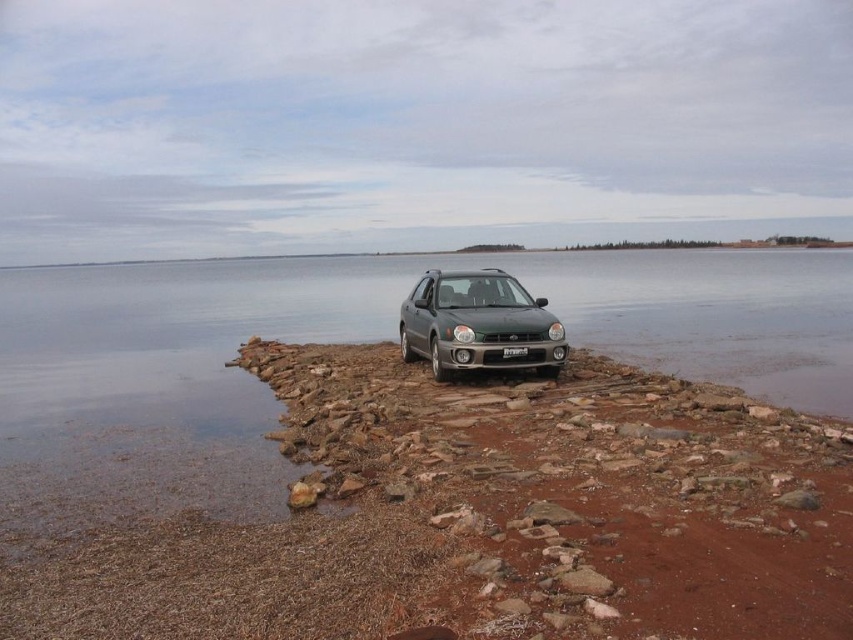
Does satin silver metallic hatchback at center have a lesser width compared to white plastic license plate at center?

Incorrect, satin silver metallic hatchback at center's width is not less than white plastic license plate at center's.

Is point (436, 280) positioned after point (502, 352)?

That is True.

Does point (527, 355) come closer to viewer compared to point (514, 355)?

No, (527, 355) is behind (514, 355).

This screenshot has width=853, height=640. In order to click on satin silver metallic hatchback at center in this screenshot , I will do `click(479, 323)`.